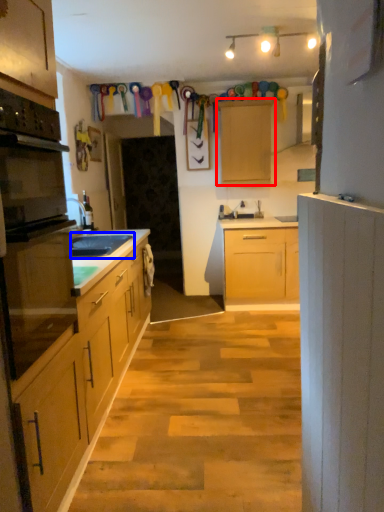
Question: Which object is closer to the camera taking this photo, cabinetry (highlighted by a red box) or sink (highlighted by a blue box)?

Choices:
 (A) cabinetry
 (B) sink

Answer: (B)